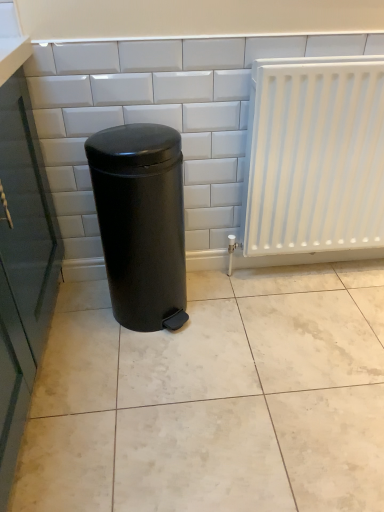
Question: Can you confirm if white glossy tile at center is wider than black matte waste container at center?

Choices:
 (A) yes
 (B) no

Answer: (B)

Question: Is white glossy tile at center shorter than black matte waste container at center?

Choices:
 (A) yes
 (B) no

Answer: (B)

Question: From a real-world perspective, is white glossy tile at center physically below black matte waste container at center?

Choices:
 (A) yes
 (B) no

Answer: (B)

Question: Is the depth of white glossy tile at center less than that of black matte waste container at center?

Choices:
 (A) no
 (B) yes

Answer: (A)

Question: Does white glossy tile at center come behind black matte waste container at center?

Choices:
 (A) no
 (B) yes

Answer: (B)

Question: Is white glossy tile at center far from black matte waste container at center?

Choices:
 (A) no
 (B) yes

Answer: (A)

Question: Is white matte radiator at right at the left side of black matte waste container at center?

Choices:
 (A) yes
 (B) no

Answer: (B)

Question: Does white matte radiator at right come in front of black matte waste container at center?

Choices:
 (A) yes
 (B) no

Answer: (B)

Question: Does white matte radiator at right have a lesser width compared to black matte waste container at center?

Choices:
 (A) yes
 (B) no

Answer: (A)

Question: Is white matte radiator at right smaller than black matte waste container at center?

Choices:
 (A) no
 (B) yes

Answer: (B)

Question: From the image's perspective, is white matte radiator at right above black matte waste container at center?

Choices:
 (A) no
 (B) yes

Answer: (B)

Question: Would you consider white matte radiator at right to be distant from black matte waste container at center?

Choices:
 (A) yes
 (B) no

Answer: (B)

Question: Is black matte waste container at center oriented towards white glossy tile at center?

Choices:
 (A) no
 (B) yes

Answer: (A)